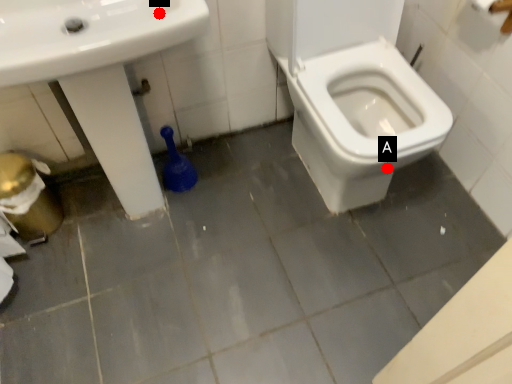
Question: Two points are circled on the image, labeled by A and B beside each circle. Which of the following is the farthest from the observer?

Choices:
 (A) A is further
 (B) B is further

Answer: (A)